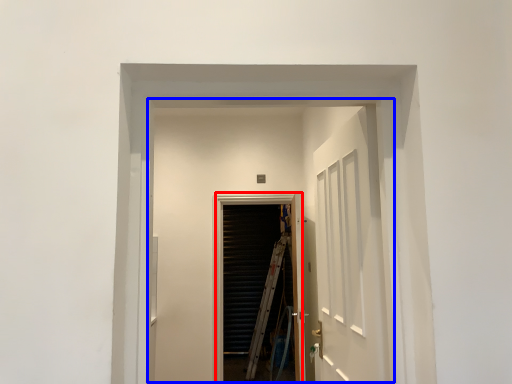
Question: Which object is closer to the camera taking this photo, screen door (highlighted by a red box) or elevator (highlighted by a blue box)?

Choices:
 (A) screen door
 (B) elevator

Answer: (B)